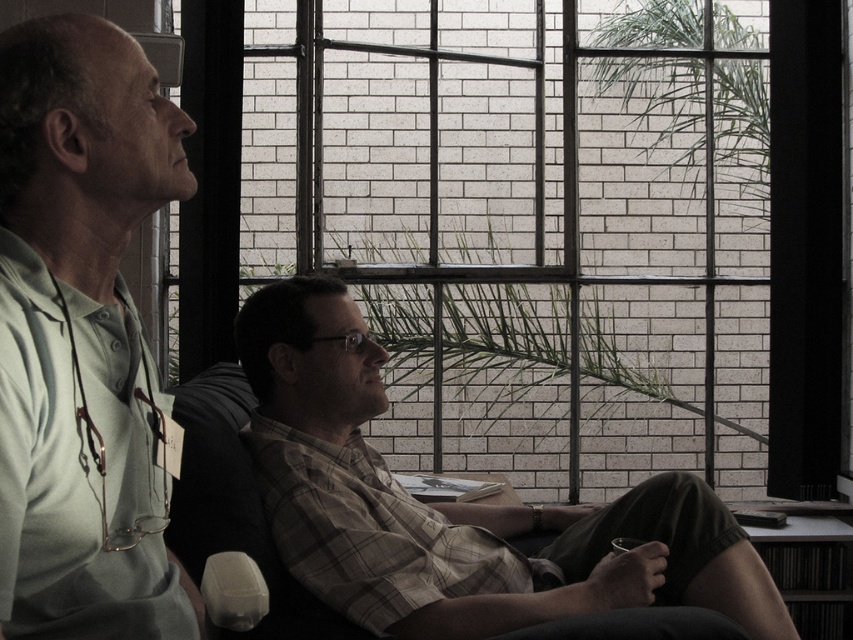
Question: Which point is closer to the camera?

Choices:
 (A) (172, 173)
 (B) (566, 525)

Answer: (A)

Question: Is clear glass window at center wider than plaid shirt at center?

Choices:
 (A) yes
 (B) no

Answer: (A)

Question: Does plaid shirt at center come in front of green matte shirt at left?

Choices:
 (A) yes
 (B) no

Answer: (B)

Question: Which object appears farthest from the camera in this image?

Choices:
 (A) green matte shirt at left
 (B) plaid shirt at center

Answer: (B)

Question: Which of the following is the closest to the observer?

Choices:
 (A) (675, 522)
 (B) (83, 195)

Answer: (B)

Question: Is plaid shirt at center wider than green matte shirt at left?

Choices:
 (A) no
 (B) yes

Answer: (B)